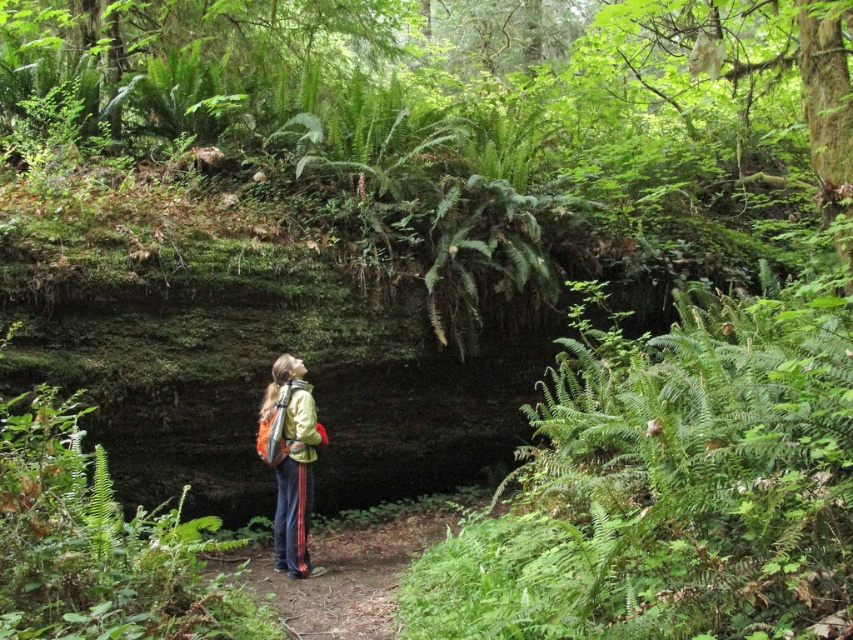
Is brown dirt trail at center bigger than green matte jacket at center?

Yes, brown dirt trail at center is bigger than green matte jacket at center.

The height and width of the screenshot is (640, 853). Describe the element at coordinates (351, 564) in the screenshot. I see `brown dirt trail at center` at that location.

Does point (387, 586) come farther from viewer compared to point (299, 404)?

No, (387, 586) is closer to viewer.

Where is `brown dirt trail at center`? The image size is (853, 640). brown dirt trail at center is located at coordinates (351, 564).